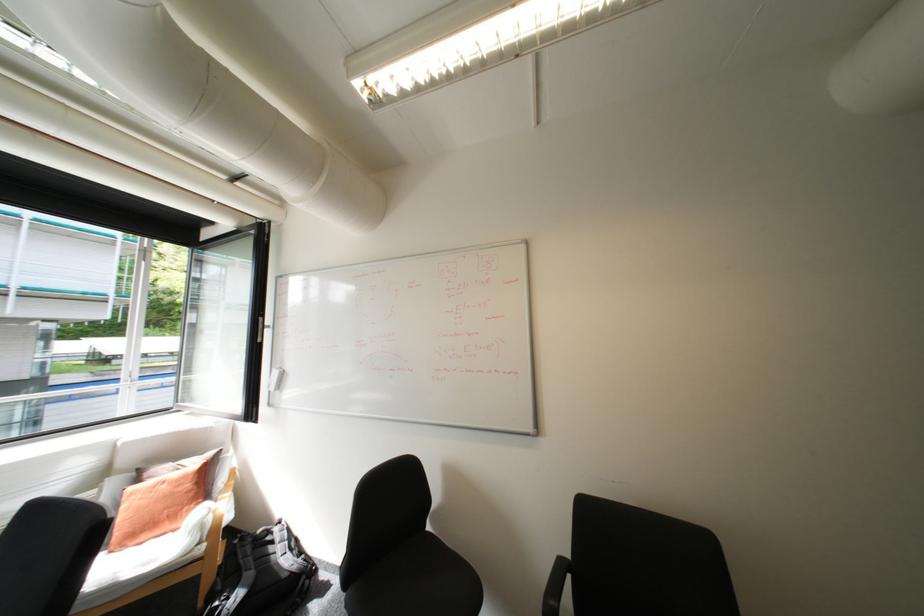
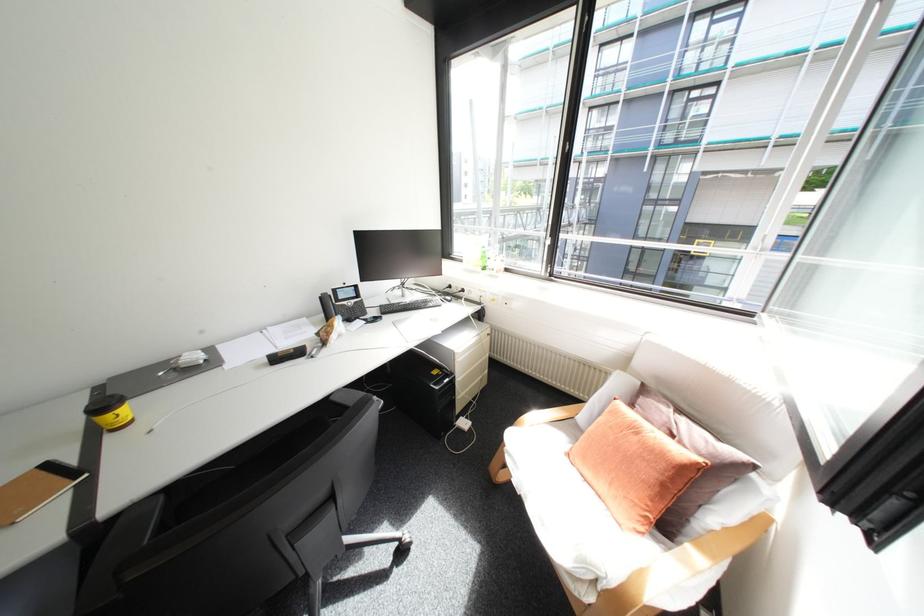
In the second image, find the point that corresponds to point (150, 499) in the first image.

(621, 428)